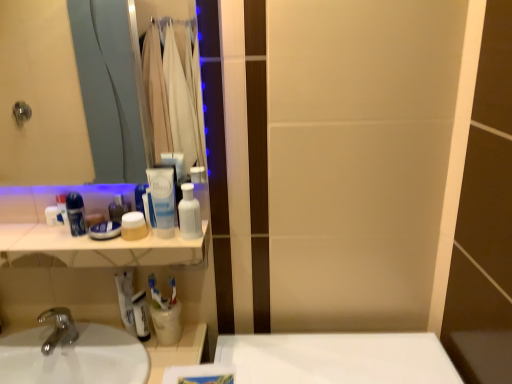
Looking at this image, measure the distance between point (56, 218) and camera.

The depth of point (56, 218) is 3.55 feet.

Measure the distance between point (125, 356) and camera.

They are 3.62 feet apart.

Identify the location of white matte toothpaste at lower left. (126, 298).

The image size is (512, 384). What do you see at coordinates (141, 316) in the screenshot?
I see `white glossy mouthwash at lower center, which is counted as the 3th mouthwash, starting from the left` at bounding box center [141, 316].

Locate an element on the screen. The height and width of the screenshot is (384, 512). blue glossy mouthwash at left, the second mouthwash viewed from the left is located at coordinates (76, 214).

From the image's perspective, is white glossy counter top at upper left located above or below blue glossy mouthwash at left, the 6th mouthwash when ordered from right to left?

Based on their image positions, white glossy counter top at upper left is located beneath blue glossy mouthwash at left, the 6th mouthwash when ordered from right to left.

Is white glossy counter top at upper left positioned beyond the bounds of blue glossy mouthwash at left, the second mouthwash viewed from the left?

white glossy counter top at upper left is positioned outside blue glossy mouthwash at left, the second mouthwash viewed from the left.

Is white glossy counter top at upper left next to blue glossy mouthwash at left, the 6th mouthwash when ordered from right to left?

No, white glossy counter top at upper left is not making contact with blue glossy mouthwash at left, the 6th mouthwash when ordered from right to left.

Is white plastic cup at lower center, which appears as the 3th mouthwash when viewed from the right, far away from blue glossy mouthwash at left, the 6th mouthwash when ordered from right to left?

They are positioned close to each other.

How much distance is there between white plastic cup at lower center, acting as the fifth mouthwash starting from the left, and blue glossy mouthwash at left, the second mouthwash viewed from the left?

A distance of 12.67 inches exists between white plastic cup at lower center, acting as the fifth mouthwash starting from the left, and blue glossy mouthwash at left, the second mouthwash viewed from the left.

Does white plastic cup at lower center, which appears as the 3th mouthwash when viewed from the right, have a lesser height compared to blue glossy mouthwash at left, the second mouthwash viewed from the left?

Yes, white plastic cup at lower center, which appears as the 3th mouthwash when viewed from the right, is shorter than blue glossy mouthwash at left, the second mouthwash viewed from the left.

What's the angular difference between white plastic cup at lower center, which appears as the 3th mouthwash when viewed from the right, and blue glossy mouthwash at left, the 6th mouthwash when ordered from right to left,'s facing directions?

There is a 1.04-degree angle between the facing directions of white plastic cup at lower center, which appears as the 3th mouthwash when viewed from the right, and blue glossy mouthwash at left, the 6th mouthwash when ordered from right to left.

Image resolution: width=512 pixels, height=384 pixels. In order to click on mouthwash that is the 2nd one when counting downward from the blue plastic mouthwash at left, the 7th mouthwash when ordered from right to left (from the image's perspective) in this screenshot , I will do 189,214.

Can you tell me how much white glossy bottle at upper center, the 7th mouthwash viewed from the left, and blue plastic mouthwash at left, the 7th mouthwash when ordered from right to left, differ in facing direction?

The facing directions of white glossy bottle at upper center, the 7th mouthwash viewed from the left, and blue plastic mouthwash at left, the 7th mouthwash when ordered from right to left, are 1.06 degrees apart.

Is point (188, 212) positioned before point (67, 224)?

Yes, it is.

From the image's perspective, is white plastic toothbrush at lower center located above matte glass mirror at upper left?

No.

Which is farther from the camera, (170, 306) or (51, 18)?

The point (51, 18) is more distant.

Can you confirm if white plastic toothbrush at lower center is smaller than matte glass mirror at upper left?

Yes.

Is white plastic toothbrush at lower center spatially inside matte glass mirror at upper left, or outside of it?

white plastic toothbrush at lower center is located beyond the bounds of matte glass mirror at upper left.

Is translucent plastic mouthwash at center, acting as the sixth mouthwash starting from the left, aimed at blue plastic mouthwash at left, which appears as the 1th mouthwash when viewed from the left?

No, translucent plastic mouthwash at center, acting as the sixth mouthwash starting from the left, does not turn towards blue plastic mouthwash at left, which appears as the 1th mouthwash when viewed from the left.

The width and height of the screenshot is (512, 384). There is a translucent plastic mouthwash at center, the 2th mouthwash when ordered from right to left. Identify the location of the 1st mouthwash below it (from the image's perspective). (62, 208).

Is blue plastic mouthwash at left, the 7th mouthwash when ordered from right to left, surrounded by translucent plastic mouthwash at center, acting as the sixth mouthwash starting from the left?

That's incorrect, blue plastic mouthwash at left, the 7th mouthwash when ordered from right to left, is not inside translucent plastic mouthwash at center, acting as the sixth mouthwash starting from the left.

From a real-world perspective, relative to matte glass mirror at upper left, is white glossy bottle at upper center, which appears as the 1th mouthwash when viewed from the right, vertically above or below?

white glossy bottle at upper center, which appears as the 1th mouthwash when viewed from the right, is below matte glass mirror at upper left.

From the image's perspective, is white glossy bottle at upper center, the 7th mouthwash viewed from the left, below matte glass mirror at upper left?

Yes.

Considering the positions of objects white glossy bottle at upper center, which appears as the 1th mouthwash when viewed from the right, and matte glass mirror at upper left in the image provided, who is more to the right, white glossy bottle at upper center, which appears as the 1th mouthwash when viewed from the right, or matte glass mirror at upper left?

white glossy bottle at upper center, which appears as the 1th mouthwash when viewed from the right.

Between white plastic cup at lower center, acting as the fifth mouthwash starting from the left, and white glossy bottle at upper center, which appears as the 1th mouthwash when viewed from the right, which one appears on the left side from the viewer's perspective?

Positioned to the left is white plastic cup at lower center, acting as the fifth mouthwash starting from the left.

Is white plastic cup at lower center, acting as the fifth mouthwash starting from the left, inside or outside of white glossy bottle at upper center, the 7th mouthwash viewed from the left?

white plastic cup at lower center, acting as the fifth mouthwash starting from the left, lies outside white glossy bottle at upper center, the 7th mouthwash viewed from the left.

From the image's perspective, would you say white plastic cup at lower center, which appears as the 3th mouthwash when viewed from the right, is shown under white glossy bottle at upper center, the 7th mouthwash viewed from the left?

Correct, white plastic cup at lower center, which appears as the 3th mouthwash when viewed from the right, appears lower than white glossy bottle at upper center, the 7th mouthwash viewed from the left, in the image.

Where is `the 2nd mouthwash behind when counting from the white glossy counter top at upper left`? This screenshot has height=384, width=512. the 2nd mouthwash behind when counting from the white glossy counter top at upper left is located at coordinates pyautogui.click(x=76, y=214).

Identify the location of the 4th mouthwash directly beneath the blue glossy mouthwash at left, the 6th mouthwash when ordered from right to left (from a real-world perspective). The height and width of the screenshot is (384, 512). (167, 323).

Considering their positions, is white glossy counter top at upper left positioned further to white glossy mouthwash at lower center, which is counted as the 3th mouthwash, starting from the left, than matte glass mirror at upper left?

matte glass mirror at upper left is further to white glossy mouthwash at lower center, which is counted as the 3th mouthwash, starting from the left.

When comparing their distances from white plastic cup at lower center, which appears as the 3th mouthwash when viewed from the right, does silver metallic faucet at lower left or matte glass mirror at upper left seem further?

matte glass mirror at upper left is further to white plastic cup at lower center, which appears as the 3th mouthwash when viewed from the right.

From the image, which object appears to be nearer to white matte toothpaste at lower left, white glossy bottle at upper center, which appears as the 1th mouthwash when viewed from the right, or silver metallic faucet at lower left?

silver metallic faucet at lower left.

When comparing their distances from white matte toothpaste at lower left, does white glossy counter top at upper left or white glossy bottle at upper center, which appears as the 1th mouthwash when viewed from the right, seem further?

white glossy bottle at upper center, which appears as the 1th mouthwash when viewed from the right, is positioned further to the anchor white matte toothpaste at lower left.

Based on their spatial positions, is white glossy sink at lower left or white plastic toothbrush at lower center closer to blue plastic mouthwash at left, which appears as the 1th mouthwash when viewed from the left?

white plastic toothbrush at lower center lies closer to blue plastic mouthwash at left, which appears as the 1th mouthwash when viewed from the left, than the other object.

From the image, which object appears to be farther from white plastic deodorant at left, white matte toothpaste at lower left or silver metallic faucet at lower left?

Based on the image, silver metallic faucet at lower left appears to be further to white plastic deodorant at left.

From the image, which object appears to be farther from white plastic toothbrush at lower center, blue glossy mouthwash at left, the second mouthwash viewed from the left, or blue plastic mouthwash at left, the 7th mouthwash when ordered from right to left?

Among the two, blue plastic mouthwash at left, the 7th mouthwash when ordered from right to left, is located further to white plastic toothbrush at lower center.

Which object lies nearer to the anchor point white matte toothpaste at lower left, white glossy bottle at upper center, which appears as the 1th mouthwash when viewed from the right, or white glossy sink at lower left?

white glossy sink at lower left is closer to white matte toothpaste at lower left.

Identify the location of counter top between blue glossy mouthwash at left, the 6th mouthwash when ordered from right to left, and white matte toothpaste at lower left, in the vertical direction. (95, 248).

Identify the location of toiletry between blue glossy mouthwash at left, the 6th mouthwash when ordered from right to left, and white glossy sink at lower left vertically. This screenshot has width=512, height=384. (53, 216).

Locate an element on the screen. counter top between matte glass mirror at upper left and white plastic toothbrush at lower center from top to bottom is located at coordinates (95, 248).

Find the location of a particular element. counter top between matte beige jar at center, which is counted as the fourth mouthwash, starting from the right, and white glossy mouthwash at lower center, which is counted as the 3th mouthwash, starting from the left, in the vertical direction is located at coordinates (95, 248).